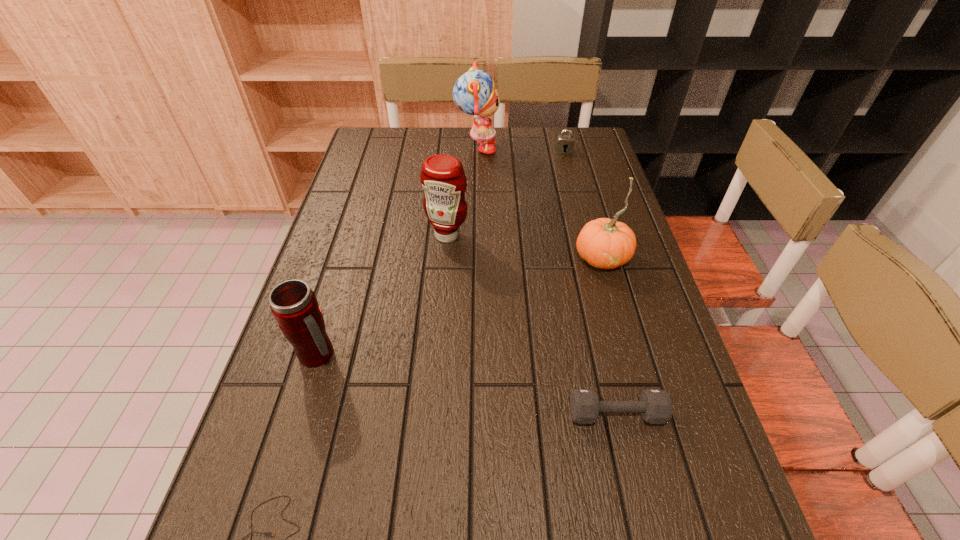
Identify which object is located as the nearest to the pumpkin. Please provide its 2D coordinates. Your answer should be formatted as a tuple, i.e. [(x, y)], where the tuple contains the x and y coordinates of a point satisfying the conditions above.

[(442, 177)]

Locate an element on the screen. This screenshot has width=960, height=540. object that is the sixth closest to the condiment is located at coordinates (270, 534).

Where is `vacant area in the image that satisfies the following two spatial constraints: 1. on the face of the second nearest object; 2. on the right side of the doll`? The width and height of the screenshot is (960, 540). vacant area in the image that satisfies the following two spatial constraints: 1. on the face of the second nearest object; 2. on the right side of the doll is located at coordinates (474, 414).

Image resolution: width=960 pixels, height=540 pixels. In order to click on free space that satisfies the following two spatial constraints: 1. at the front of the padlock near the keyhole; 2. on the side with the handle of the thermos bottle in this screenshot , I will do `click(615, 355)`.

This screenshot has width=960, height=540. What are the coordinates of `vacant space that satisfies the following two spatial constraints: 1. on the front side of the pumpkin; 2. on the right side of the condiment` in the screenshot? It's located at (445, 258).

You are a GUI agent. You are given a task and a screenshot of the screen. Output one action in this format:
    pyautogui.click(x=<x>, y=<y>)
    Task: Click on the free spot that satisfies the following two spatial constraints: 1. on the front side of the pumpkin; 2. on the side with the handle of the thermos bottle
    This screenshot has height=540, width=960.
    Given the screenshot: What is the action you would take?
    pyautogui.click(x=629, y=355)